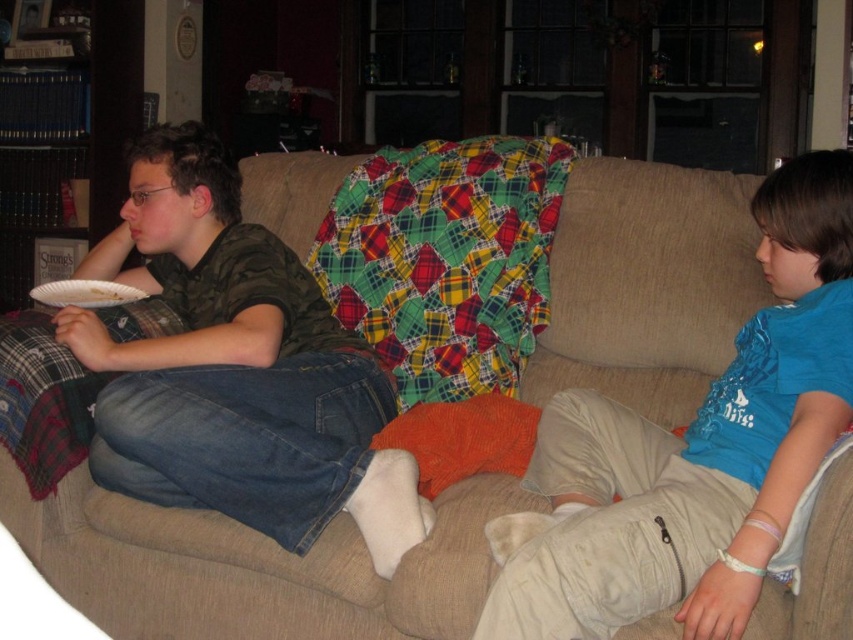
Question: In this image, where is blue cotton shirt at right located relative to white paper plate at left?

Choices:
 (A) right
 (B) left

Answer: (A)

Question: Does blue cotton shirt at right appear on the right side of white paper plate at left?

Choices:
 (A) yes
 (B) no

Answer: (A)

Question: Considering the real-world distances, which object is farthest from the matte green shirt at left?

Choices:
 (A) white paper plate at left
 (B) blue cotton shirt at right

Answer: (B)

Question: Which object appears farthest from the camera in this image?

Choices:
 (A) matte green shirt at left
 (B) white paper plate at left

Answer: (B)

Question: In this image, where is matte green shirt at left located relative to white paper plate at left?

Choices:
 (A) left
 (B) right

Answer: (B)

Question: Which point is closer to the camera?

Choices:
 (A) (807, 179)
 (B) (86, 280)

Answer: (A)